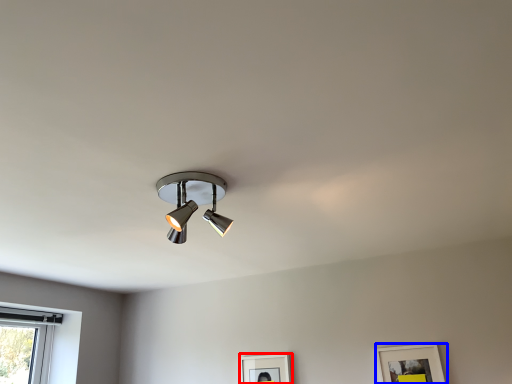
Question: Which point is further to the camera, picture frame (highlighted by a red box) or picture frame (highlighted by a blue box)?

Choices:
 (A) picture frame
 (B) picture frame

Answer: (A)